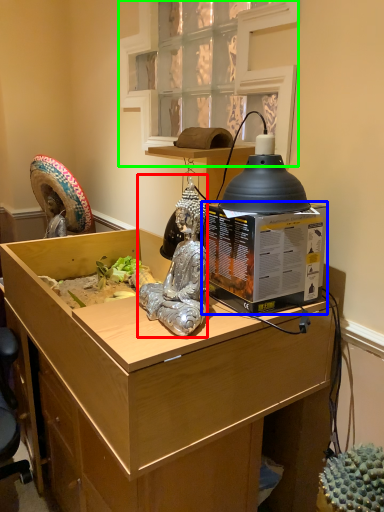
Question: Based on their relative distances, which object is farther from person (highlighted by a red box)? Choose from box (highlighted by a blue box) and window (highlighted by a green box).

Choices:
 (A) box
 (B) window

Answer: (B)